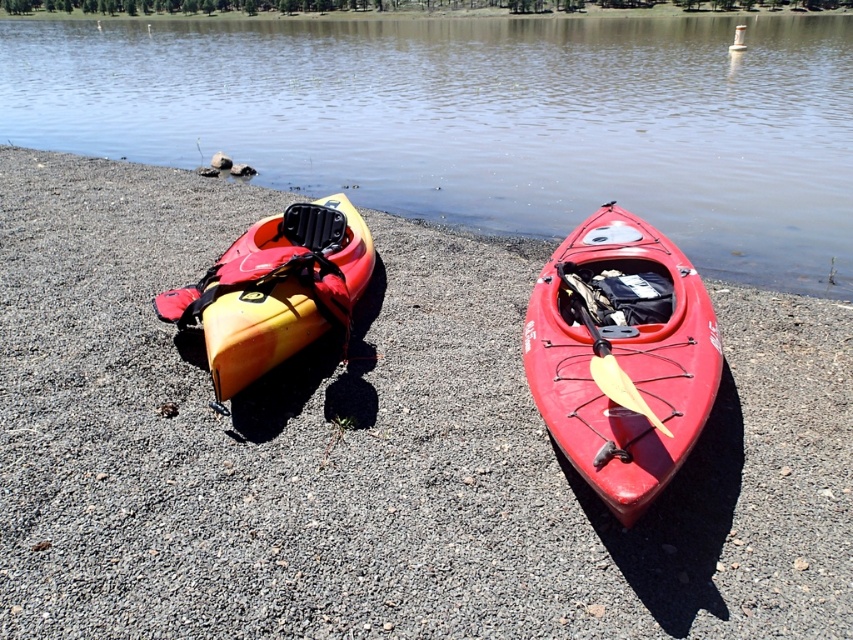
Does transparent water at center appear under matte red kayak at center?

No, transparent water at center is not below matte red kayak at center.

Does transparent water at center have a greater height compared to matte red kayak at center?

Correct, transparent water at center is much taller as matte red kayak at center.

Is point (712, 154) positioned behind point (614, 275)?

That is True.

Find the location of a particular element. transparent water at center is located at coordinates (482, 120).

Does matte red kayak at center have a smaller size compared to yellow matte kayak at left?

Actually, matte red kayak at center might be larger than yellow matte kayak at left.

The height and width of the screenshot is (640, 853). Describe the element at coordinates (621, 355) in the screenshot. I see `matte red kayak at center` at that location.

Is point (537, 378) farther from camera compared to point (318, 332)?

No, it is not.

At what (x,y) coordinates should I click in order to perform the action: click on matte red kayak at center. Please return your answer as a coordinate pair (x, y). Image resolution: width=853 pixels, height=640 pixels. Looking at the image, I should click on (621, 355).

Can you confirm if transparent water at center is taller than yellow matte kayak at left?

Correct, transparent water at center is much taller as yellow matte kayak at left.

Does transparent water at center have a smaller size compared to yellow matte kayak at left?

Actually, transparent water at center might be larger than yellow matte kayak at left.

Is point (196, 68) closer to viewer compared to point (294, 337)?

No.

Where is `transparent water at center`? The height and width of the screenshot is (640, 853). transparent water at center is located at coordinates (482, 120).